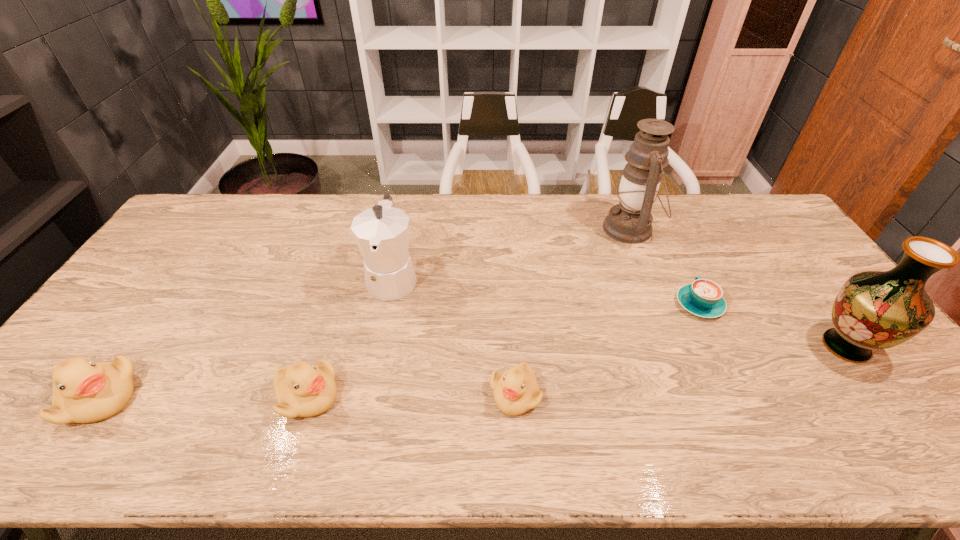
This screenshot has height=540, width=960. Find the location of `object that is at the right edge`. object that is at the right edge is located at coordinates [x=875, y=310].

Identify the location of object located at the near left corner. (84, 391).

In the image, there is a desktop. Where is `vacant space at the far edge`? This screenshot has width=960, height=540. vacant space at the far edge is located at coordinates (332, 193).

Locate an element on the screen. vacant space at the near edge of the desktop is located at coordinates (445, 406).

In the image, there is a desktop. At what (x,y) coordinates should I click in order to perform the action: click on vacant area at the right edge. Please return your answer as a coordinate pair (x, y). This screenshot has height=540, width=960. Looking at the image, I should click on pyautogui.click(x=831, y=309).

Image resolution: width=960 pixels, height=540 pixels. In order to click on free spot at the far right corner of the desktop in this screenshot , I will do `click(732, 196)`.

Identify the location of unoccupied area between the coffeepot and the oil lamp. pyautogui.click(x=512, y=253).

Image resolution: width=960 pixels, height=540 pixels. Find the location of `free spot between the cappuccino and the coffeepot`. free spot between the cappuccino and the coffeepot is located at coordinates [546, 291].

I want to click on vacant space that's between the shortest object and the second tallest duckling, so click(x=503, y=350).

Locate an element on the screen. The height and width of the screenshot is (540, 960). free space between the leftmost duckling and the third tallest object is located at coordinates (246, 338).